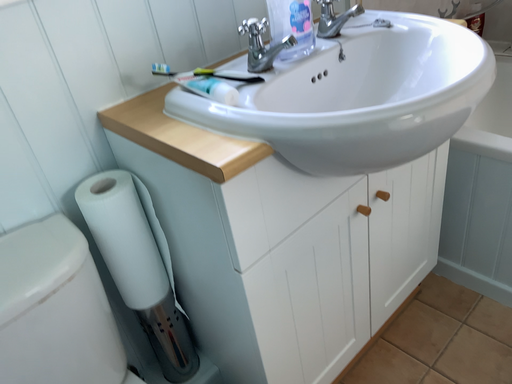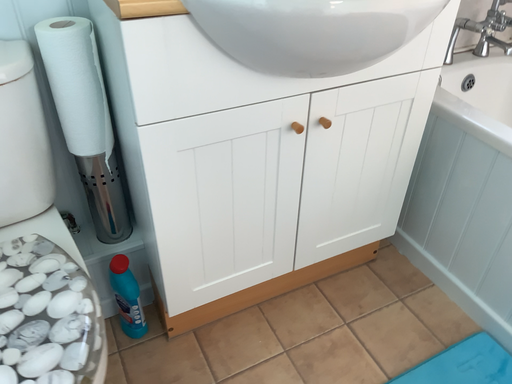
Question: Which way did the camera rotate in the video?

Choices:
 (A) rotated left
 (B) rotated right

Answer: (A)